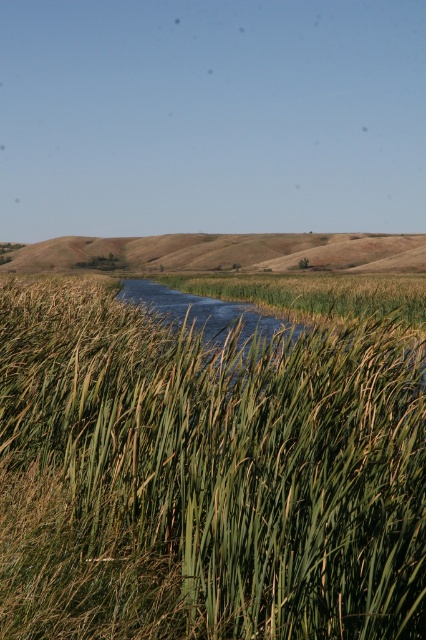
Question: Can you confirm if green grassy at center is positioned to the right of brown grassy hillside at center?

Choices:
 (A) no
 (B) yes

Answer: (B)

Question: Does green grassy at center appear on the right side of brown grassy hillside at center?

Choices:
 (A) yes
 (B) no

Answer: (A)

Question: Which of the following is the closest to the observer?

Choices:
 (A) (232, 243)
 (B) (198, 406)

Answer: (B)

Question: Does green grassy at center appear on the left side of brown grassy hillside at center?

Choices:
 (A) no
 (B) yes

Answer: (A)